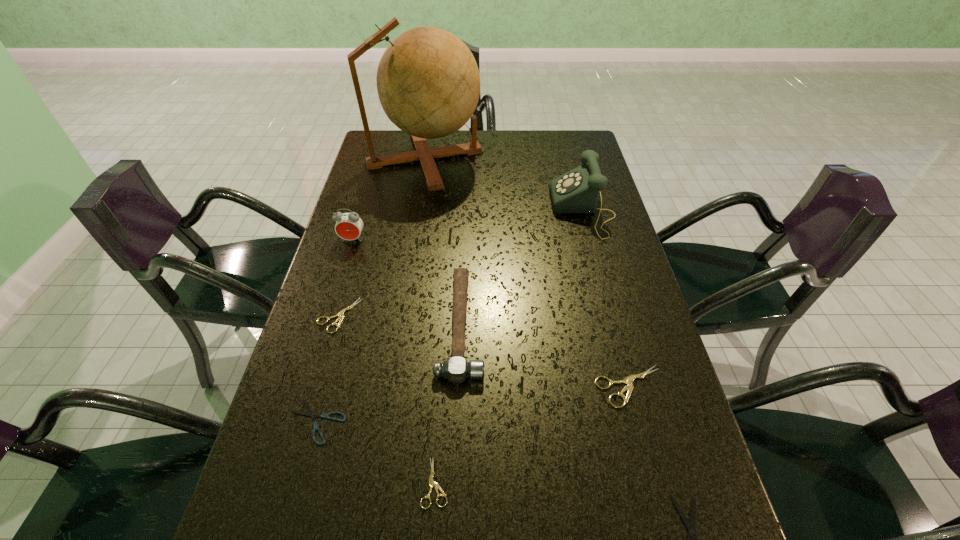
You are a GUI agent. You are given a task and a screenshot of the screen. Output one action in this format:
    pyautogui.click(x=<x>, y=<y>)
    Task: Click on the nearest beige shears
    This screenshot has height=540, width=960.
    Given the screenshot: What is the action you would take?
    pyautogui.click(x=432, y=484)

At what (x,y) coordinates should I click in order to perform the action: click on the farther black shears. Please return your answer as a coordinate pair (x, y). This screenshot has height=540, width=960. Looking at the image, I should click on (315, 427).

The height and width of the screenshot is (540, 960). Identify the location of the left black shears. (315, 427).

I want to click on free space located 0.390m on the surface of the globe, so click(x=591, y=158).

The width and height of the screenshot is (960, 540). Find the location of `vacant space located on the dial of the telephone`. vacant space located on the dial of the telephone is located at coordinates (511, 211).

Image resolution: width=960 pixels, height=540 pixels. I want to click on vacant area situated 0.190m on the dial of the telephone, so click(492, 211).

Where is `free space located 0.250m on the dial of the telephone`? Image resolution: width=960 pixels, height=540 pixels. free space located 0.250m on the dial of the telephone is located at coordinates (471, 211).

Where is `vacant region located on the face of the seventh shortest object`? The image size is (960, 540). vacant region located on the face of the seventh shortest object is located at coordinates (319, 350).

Find the location of `free location located 0.090m on the striking face of the sixth shortest object`. free location located 0.090m on the striking face of the sixth shortest object is located at coordinates (521, 325).

The width and height of the screenshot is (960, 540). Find the location of `blank space located 0.170m on the left of the tallest shears`. blank space located 0.170m on the left of the tallest shears is located at coordinates (516, 387).